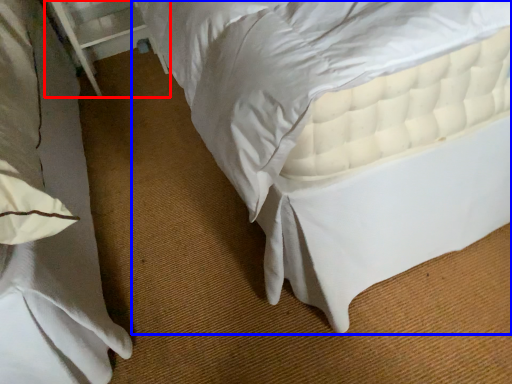
Question: Which of the following is the closest to the observer, balustrade (highlighted by a red box) or bed (highlighted by a blue box)?

Choices:
 (A) balustrade
 (B) bed

Answer: (B)